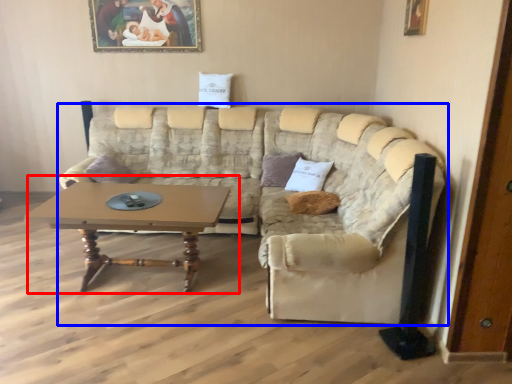
Question: Which point is further to the camera, coffee table (highlighted by a red box) or studio couch (highlighted by a blue box)?

Choices:
 (A) coffee table
 (B) studio couch

Answer: (A)